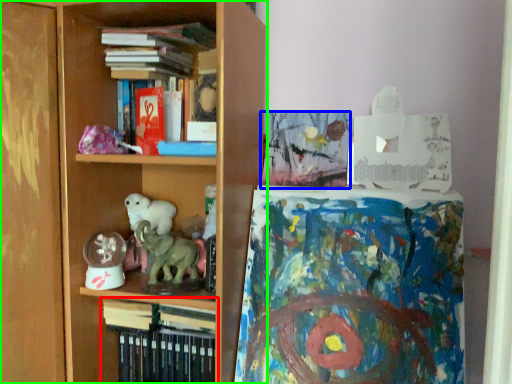
Question: Which object is the farthest from book (highlighted by a red box)? Choose among these: book (highlighted by a blue box) or shelf (highlighted by a green box).

Choices:
 (A) book
 (B) shelf

Answer: (A)